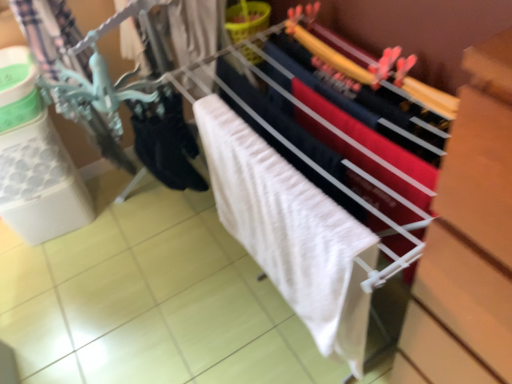
Where is `white fabric at center`? white fabric at center is located at coordinates (342, 155).

The image size is (512, 384). In order to click on black matte socks at lower left in this screenshot , I will do pos(166,141).

Is point (225, 196) closer or farther from the camera than point (340, 129)?

Point (225, 196) is farther from the camera than point (340, 129).

Is white textured bath towel at center next to white fabric at center?

No, white textured bath towel at center is not touching white fabric at center.

Considering the positions of objects white textured bath towel at center and white fabric at center in the image provided, who is in front, white textured bath towel at center or white fabric at center?

white fabric at center is in front.

Who is taller, white textured bath towel at center or white fabric at center?

white fabric at center.

Which is in front, black matte socks at lower left or white fabric at center?

white fabric at center.

Is black matte socks at lower left bigger or smaller than white fabric at center?

In the image, black matte socks at lower left appears to be smaller than white fabric at center.

Which point is more forward, (162, 93) or (228, 80)?

The point (228, 80) is more forward.

Based on the photo, is white fabric at center facing away from black matte socks at lower left?

No, white fabric at center is not facing the opposite direction of black matte socks at lower left.

Locate an element on the screen. This screenshot has height=384, width=512. closet below the black matte socks at lower left (from a real-world perspective) is located at coordinates (342, 155).

Does white fabric at center appear on the left side of black matte socks at lower left?

Incorrect, white fabric at center is not on the left side of black matte socks at lower left.

In terms of width, does white fabric at center look wider or thinner when compared to black matte socks at lower left?

Clearly, white fabric at center has more width compared to black matte socks at lower left.

Can you tell me how much black matte socks at lower left and white textured bath towel at center differ in facing direction?

The angle between the facing direction of black matte socks at lower left and the facing direction of white textured bath towel at center is 86.7 degrees.

Considering the sizes of objects black matte socks at lower left and white textured bath towel at center in the image provided, who is smaller, black matte socks at lower left or white textured bath towel at center?

With smaller size is black matte socks at lower left.

Which object is positioned more to the left, black matte socks at lower left or white textured bath towel at center?

black matte socks at lower left.

Looking at this image, is black matte socks at lower left located outside white textured bath towel at center?

Yes, black matte socks at lower left is outside of white textured bath towel at center.

Is the surface of white fabric at center in direct contact with white textured bath towel at center?

They are not placed beside each other.

Which object is wider, white fabric at center or white textured bath towel at center?

white fabric at center is wider.

From a real-world perspective, is white fabric at center located higher than white textured bath towel at center?

No, from a real-world perspective, white fabric at center is not over white textured bath towel at center

Image resolution: width=512 pixels, height=384 pixels. I want to click on closet on the right side of white textured bath towel at center, so click(x=342, y=155).

Is white textured bath towel at center turned away from black matte socks at lower left?

That's not correct — white textured bath towel at center is not looking away from black matte socks at lower left.

From a real-world perspective, which object stands above the other?

black matte socks at lower left.

Considering the sizes of white textured bath towel at center and black matte socks at lower left in the image, is white textured bath towel at center taller or shorter than black matte socks at lower left?

In the image, white textured bath towel at center appears to be taller than black matte socks at lower left.

What are the coordinates of `bath towel behind the white fabric at center` in the screenshot? It's located at (290, 231).

In order to click on closet below the black matte socks at lower left (from the image's perspective) in this screenshot , I will do `click(342, 155)`.

From the image, which object appears to be farther from white textured bath towel at center, white fabric at center or black matte socks at lower left?

black matte socks at lower left.

Consider the image. Which object lies nearer to the anchor point white textured bath towel at center, black matte socks at lower left or white fabric at center?

white fabric at center lies closer to white textured bath towel at center than the other object.

Looking at this image, based on their spatial positions, is black matte socks at lower left or white textured bath towel at center further from white fabric at center?

black matte socks at lower left.

Looking at the image, which one is located further to black matte socks at lower left, white fabric at center or white textured bath towel at center?

white textured bath towel at center is positioned further to the anchor black matte socks at lower left.

From the image, which object appears to be farther from black matte socks at lower left, white textured bath towel at center or white fabric at center?

white textured bath towel at center.

Based on their spatial positions, is white textured bath towel at center or black matte socks at lower left further from white fabric at center?

Among the two, black matte socks at lower left is located further to white fabric at center.

Image resolution: width=512 pixels, height=384 pixels. I want to click on bath towel between white fabric at center and black matte socks at lower left in the front-back direction, so click(x=290, y=231).